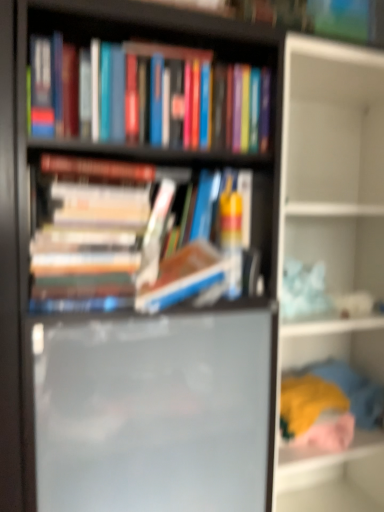
Question: Is hardcover books at center, positioned as the second book in top-to-bottom order, not close to hardcover books at upper center, which appears as the second book when ordered from the bottom?

Choices:
 (A) yes
 (B) no

Answer: (B)

Question: From a real-world perspective, is hardcover books at center, positioned as the second book in top-to-bottom order, positioned under hardcover books at upper center, the 1th book from the top, based on gravity?

Choices:
 (A) yes
 (B) no

Answer: (A)

Question: Is the position of hardcover books at center, which appears as the first book when ordered from the bottom, less distant than that of hardcover books at upper center, the 1th book from the top?

Choices:
 (A) no
 (B) yes

Answer: (B)

Question: Is hardcover books at center, which appears as the first book when ordered from the bottom, facing towards hardcover books at upper center, the 1th book from the top?

Choices:
 (A) yes
 (B) no

Answer: (B)

Question: Can you confirm if hardcover books at center, positioned as the second book in top-to-bottom order, is thinner than hardcover books at upper center, which appears as the second book when ordered from the bottom?

Choices:
 (A) no
 (B) yes

Answer: (B)

Question: Is hardcover books at center, which appears as the first book when ordered from the bottom, not within hardcover books at upper center, the 1th book from the top?

Choices:
 (A) no
 (B) yes

Answer: (B)

Question: From a real-world perspective, does matte black bookshelf at center stand above white matte shelf at upper right, which is the 2th shelf in bottom-to-top order?

Choices:
 (A) yes
 (B) no

Answer: (A)

Question: Is matte black bookshelf at center taller than white matte shelf at upper right, which is the 2th shelf in bottom-to-top order?

Choices:
 (A) no
 (B) yes

Answer: (A)

Question: Is white matte shelf at upper right, the 1th shelf when ordered from top to bottom, a part of matte black bookshelf at center?

Choices:
 (A) no
 (B) yes

Answer: (A)

Question: Considering the relative sizes of matte black bookshelf at center and white matte shelf at upper right, the 1th shelf when ordered from top to bottom, in the image provided, is matte black bookshelf at center thinner than white matte shelf at upper right, the 1th shelf when ordered from top to bottom,?

Choices:
 (A) yes
 (B) no

Answer: (A)

Question: Is matte black bookshelf at center to the left of white matte shelf at upper right, which is the 2th shelf in bottom-to-top order, from the viewer's perspective?

Choices:
 (A) yes
 (B) no

Answer: (A)

Question: Considering the relative positions of matte black bookshelf at center and white matte shelf at upper right, which is the 2th shelf in bottom-to-top order, in the image provided, is matte black bookshelf at center to the right of white matte shelf at upper right, which is the 2th shelf in bottom-to-top order, from the viewer's perspective?

Choices:
 (A) yes
 (B) no

Answer: (B)

Question: From a real-world perspective, is hardcover books at center, which appears as the first book when ordered from the bottom, positioned under soft fabric clothes at lower right, the second shelf in the top-to-bottom sequence, based on gravity?

Choices:
 (A) yes
 (B) no

Answer: (B)